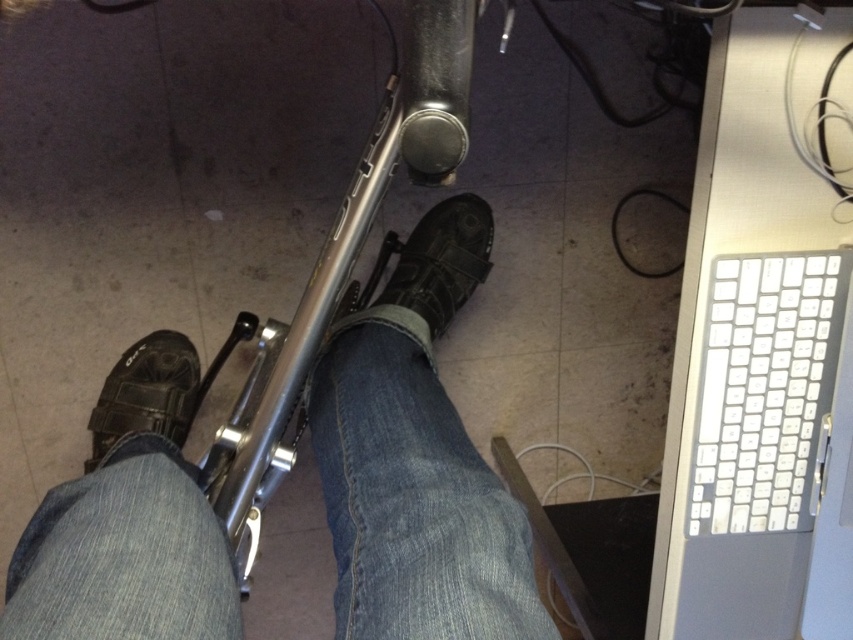
In the scene shown: Which is more to the right, white plastic keyboard at right or leather boot at center?

Positioned to the right is white plastic keyboard at right.

Can you confirm if white plastic keyboard at right is positioned below leather boot at center?

Yes, white plastic keyboard at right is below leather boot at center.

Between point (817, 260) and point (490, 224), which one is positioned behind?

Point (490, 224)

This screenshot has height=640, width=853. In order to click on white plastic keyboard at right in this screenshot , I will do `click(764, 388)`.

Does matte black shoe at center have a larger size compared to white plastic keyboard at right?

Yes, matte black shoe at center is bigger than white plastic keyboard at right.

Is matte black shoe at center smaller than white plastic keyboard at right?

Incorrect, matte black shoe at center is not smaller in size than white plastic keyboard at right.

Does point (97, 540) come behind point (735, 445)?

No.

In order to click on matte black shoe at center in this screenshot , I will do `click(416, 460)`.

Based on the photo, is matte black shoe at center positioned in front of leather boot at center?

Yes, matte black shoe at center is in front of leather boot at center.

Is matte black shoe at center to the left of leather boot at center from the viewer's perspective?

Correct, you'll find matte black shoe at center to the left of leather boot at center.

Is point (108, 483) farther from camera compared to point (437, 282)?

No.

Where is `matte black shoe at center`? matte black shoe at center is located at coordinates (416, 460).